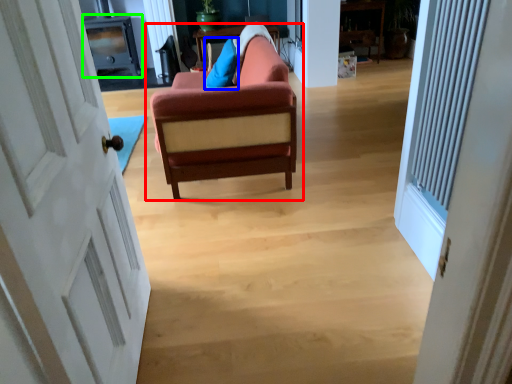
Question: Considering the real-world distances, which object is closest to studio couch (highlighted by a red box)? pillow (highlighted by a blue box) or entertainment center (highlighted by a green box).

Choices:
 (A) pillow
 (B) entertainment center

Answer: (A)